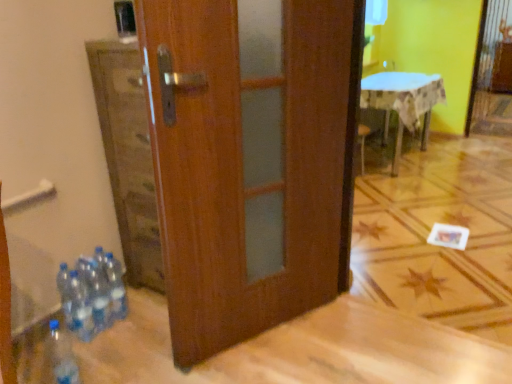
At what (x,y) coordinates should I click in order to perform the action: click on vacant area that lies to the right of clear plastic bottles at lower left, the 3th bottle positioned from the back. Please return your answer as a coordinate pair (x, y). This screenshot has height=384, width=512. Looking at the image, I should click on (122, 335).